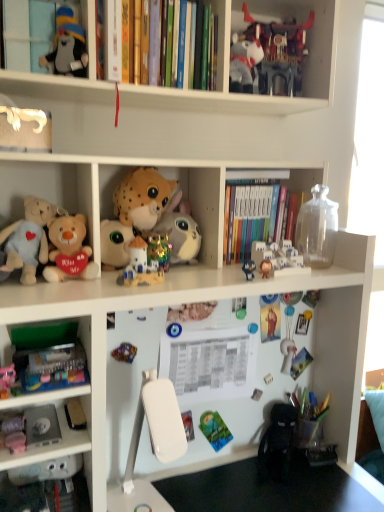
Identify the location of white plastic castle at upper center, marked as the fifth toy in a bottom-to-top arrangement. The image size is (384, 512). (279, 258).

This screenshot has width=384, height=512. Describe the element at coordinates (279, 258) in the screenshot. I see `white plastic castle at upper center, which ranks as the fifth toy in top-to-bottom order` at that location.

What is the approximate height of shiny plastic castle at center, arranged as the fourth toy when ordered from the bottom?

shiny plastic castle at center, arranged as the fourth toy when ordered from the bottom, is 4.32 inches tall.

Describe the element at coordinates (61, 228) in the screenshot. I see `soft plush toys at left, acting as the second shelf starting from the top` at that location.

Find the location of a particular element. This screenshot has height=512, width=384. matte black stuffed animal at upper left, the 2th shelf when ordered from bottom to top is located at coordinates (226, 90).

Measure the distance between soft plush toy at center, the 2th cabinet when ordered from top to bottom, and camera.

The depth of soft plush toy at center, the 2th cabinet when ordered from top to bottom, is 3.46 feet.

The image size is (384, 512). I want to click on soft plush toy at center, which is the 1th cabinet in right-to-left order, so pyautogui.click(x=173, y=212).

The image size is (384, 512). Describe the element at coordinates (207, 47) in the screenshot. I see `hardcover books at upper center, marked as the 2th book in a back-to-front arrangement` at that location.

Find the location of a particular element. The height and width of the screenshot is (512, 384). white plastic castle at upper center, marked as the fifth toy in a bottom-to-top arrangement is located at coordinates (279, 258).

Does matte pink plush at lower left, marked as the 9th toy in a top-to-bottom arrangement, have a smaller size compared to soft plush toys at left, acting as the second shelf starting from the top?

Indeed, matte pink plush at lower left, marked as the 9th toy in a top-to-bottom arrangement, has a smaller size compared to soft plush toys at left, acting as the second shelf starting from the top.

Based on the photo, is matte pink plush at lower left, arranged as the 1th toy when ordered from the bottom, at the left side of soft plush toys at left, acting as the second shelf starting from the top?

Yes.

From a real-world perspective, is matte pink plush at lower left, arranged as the 1th toy when ordered from the bottom, positioned over soft plush toys at left, acting as the second shelf starting from the top, based on gravity?

No.

Which is in front, point (23, 440) or point (60, 233)?

Positioned in front is point (23, 440).

Considering the sizes of objects hardcover books at center, marked as the second book in a front-to-back arrangement, and white plastic table at lower center in the image provided, who is shorter, hardcover books at center, marked as the second book in a front-to-back arrangement, or white plastic table at lower center?

With less height is white plastic table at lower center.

From a real-world perspective, between hardcover books at center, which is the 1th book from right to left, and white plastic table at lower center, who is vertically lower?

white plastic table at lower center, from a real-world perspective.

In the image, is hardcover books at center, marked as the second book in a front-to-back arrangement, positioned in front of or behind white plastic table at lower center?

Clearly, hardcover books at center, marked as the second book in a front-to-back arrangement, is behind white plastic table at lower center.

From the image's perspective, is hardcover books at center, the 2th book in the top-to-bottom sequence, above or below white plastic table at lower center?

Clearly, from the image's perspective, hardcover books at center, the 2th book in the top-to-bottom sequence, is above white plastic table at lower center.

From a real-world perspective, is hardcover books at center, placed as the 2th book when sorted from left to right, located beneath soft plush toys at left, the 1th shelf ordered from the bottom?

Actually, hardcover books at center, placed as the 2th book when sorted from left to right, is physically above soft plush toys at left, the 1th shelf ordered from the bottom, in the real world.

Does hardcover books at center, the 1th book ordered from the bottom, have a greater width compared to soft plush toys at left, acting as the second shelf starting from the top?

Yes.

In the scene shown: Between hardcover books at center, marked as the second book in a front-to-back arrangement, and soft plush toys at left, acting as the second shelf starting from the top, which one is positioned in front?

Positioned in front is soft plush toys at left, acting as the second shelf starting from the top.

Is fluffy beige bear at left, the sixth toy when ordered from bottom to top, turned away from shiny plastic robot at upper center, the ninth toy positioned from the bottom?

No, fluffy beige bear at left, the sixth toy when ordered from bottom to top, is not facing away from shiny plastic robot at upper center, the ninth toy positioned from the bottom.

At what (x,y) coordinates should I click in order to perform the action: click on the 6th toy counting from the left of the shiny plastic robot at upper center, which appears as the 1th toy when viewed from the top. Please return your answer as a coordinate pair (x, y). Looking at the image, I should click on (69, 250).

Between fluffy beige bear at left, the sixth toy when ordered from bottom to top, and shiny plastic robot at upper center, the ninth toy positioned from the bottom, which one is positioned behind?

shiny plastic robot at upper center, the ninth toy positioned from the bottom, is more distant.

Would you say fluffy beige bear at left, the sixth toy when ordered from bottom to top, is a long distance from shiny plastic robot at upper center, which appears as the 1th toy when viewed from the top?

They are positioned close to each other.

From a real-world perspective, between matte plush toy at upper left, the 2th cabinet from the right, and white plastic castle at upper center, marked as the fifth toy in a bottom-to-top arrangement, who is vertically lower?

white plastic castle at upper center, marked as the fifth toy in a bottom-to-top arrangement, is physically lower.

Is matte plush toy at upper left, positioned as the second cabinet in bottom-to-top order, next to white plastic castle at upper center, which ranks as the fifth toy in top-to-bottom order?

No, matte plush toy at upper left, positioned as the second cabinet in bottom-to-top order, is not in contact with white plastic castle at upper center, which ranks as the fifth toy in top-to-bottom order.

Is matte plush toy at upper left, the 1th cabinet viewed from the top, closer to camera compared to white plastic castle at upper center, which ranks as the fifth toy in top-to-bottom order?

Yes.

From the image's perspective, is matte plush toy at upper left, the 1th cabinet viewed from the top, beneath white plastic castle at upper center, marked as the fifth toy in a bottom-to-top arrangement?

Actually, matte plush toy at upper left, the 1th cabinet viewed from the top, appears above white plastic castle at upper center, marked as the fifth toy in a bottom-to-top arrangement, in the image.

What are the coordinates of `table lying in front of the hardcover books at upper center, the first book when ordered from left to right` in the screenshot? It's located at (267, 489).

Considering their positions, is hardcover books at upper center, the 1th book when ordered from front to back, located in front of or behind white plastic table at lower center?

hardcover books at upper center, the 1th book when ordered from front to back, is behind white plastic table at lower center.

Considering the sizes of hardcover books at upper center, the 1th book when ordered from front to back, and white plastic table at lower center in the image, is hardcover books at upper center, the 1th book when ordered from front to back, taller or shorter than white plastic table at lower center?

hardcover books at upper center, the 1th book when ordered from front to back, is taller than white plastic table at lower center.

Can you confirm if hardcover books at upper center, which ranks as the 2th book in right-to-left order, is wider than white plastic table at lower center?

Incorrect, the width of hardcover books at upper center, which ranks as the 2th book in right-to-left order, does not surpass that of white plastic table at lower center.

What's the angular difference between matte black stuffed animal at upper left, the 1th shelf when ordered from top to bottom, and matte blue plush at upper center, the 2th toy positioned from the bottom,'s facing directions?

matte black stuffed animal at upper left, the 1th shelf when ordered from top to bottom, and matte blue plush at upper center, the 2th toy positioned from the bottom, are facing 0.00356 degrees away from each other.

Does matte black stuffed animal at upper left, the 1th shelf when ordered from top to bottom, have a smaller size compared to matte blue plush at upper center, the eighth toy from the top?

Incorrect, matte black stuffed animal at upper left, the 1th shelf when ordered from top to bottom, is not smaller in size than matte blue plush at upper center, the eighth toy from the top.

How much distance is there between matte black stuffed animal at upper left, the 2th shelf when ordered from bottom to top, and matte blue plush at upper center, the 2th toy positioned from the bottom?

matte black stuffed animal at upper left, the 2th shelf when ordered from bottom to top, and matte blue plush at upper center, the 2th toy positioned from the bottom, are 52.67 centimeters apart.

Is matte black stuffed animal at upper left, the 1th shelf when ordered from top to bottom, in front of or behind matte blue plush at upper center, the eighth toy from the top, in the image?

matte black stuffed animal at upper left, the 1th shelf when ordered from top to bottom, is in front of matte blue plush at upper center, the eighth toy from the top.

From the image's perspective, count 7th toys downward from the soft plush toys at left, the 1th shelf ordered from the bottom, and point to it. Please provide its 2D coordinates.

[(13, 434)]

The width and height of the screenshot is (384, 512). I want to click on book that is the 1st object located above the white plastic table at lower center (from the image's perspective), so click(251, 216).

Considering their positions, is shiny plastic castle at center, the sixth toy when ordered from top to bottom, positioned further to fluffy beige stuffed animal at center-left, the seventh toy when ordered from bottom to top, than matte plush toy at upper left, positioned as the second cabinet in bottom-to-top order?

matte plush toy at upper left, positioned as the second cabinet in bottom-to-top order, is positioned further to the anchor fluffy beige stuffed animal at center-left, the seventh toy when ordered from bottom to top.

Considering their positions, is matte black plush toy at upper left, arranged as the eighth toy when ordered from the bottom, positioned closer to hardcover books at upper center, marked as the 2th book in a back-to-front arrangement, than matte blue plush at upper center, the 2th toy positioned from the bottom?

The object closer to hardcover books at upper center, marked as the 2th book in a back-to-front arrangement, is matte black plush toy at upper left, arranged as the eighth toy when ordered from the bottom.

Which object lies further to the anchor point shiny plastic robot at upper center, which appears as the 1th toy when viewed from the top, fluffy beige bear at left, which ranks as the 4th toy in top-to-bottom order, or hardcover books at center, which is the 1th book from right to left?

The object further to shiny plastic robot at upper center, which appears as the 1th toy when viewed from the top, is fluffy beige bear at left, which ranks as the 4th toy in top-to-bottom order.

When comparing their distances from matte pink plush at lower left, marked as the 9th toy in a top-to-bottom arrangement, does matte black stuffed animal at upper left, the 1th shelf when ordered from top to bottom, or shiny plastic castle at center, the sixth toy when ordered from top to bottom, seem closer?

shiny plastic castle at center, the sixth toy when ordered from top to bottom, is closer to matte pink plush at lower left, marked as the 9th toy in a top-to-bottom arrangement.

Based on their spatial positions, is soft plush toys at left, acting as the second shelf starting from the top, or shiny plastic castle at center, the sixth toy when ordered from top to bottom, further from soft plush toy at center, which is counted as the 1th cabinet, starting from the bottom?

Based on the image, soft plush toys at left, acting as the second shelf starting from the top, appears to be further to soft plush toy at center, which is counted as the 1th cabinet, starting from the bottom.

Considering their positions, is matte black plush toy at upper left, acting as the second toy starting from the top, positioned closer to metallic multicolored toy at center, the 7th toy when ordered from top to bottom, than matte black stuffed animal at upper left, the 2th shelf when ordered from bottom to top?

Based on the image, matte black stuffed animal at upper left, the 2th shelf when ordered from bottom to top, appears to be nearer to metallic multicolored toy at center, the 7th toy when ordered from top to bottom.

Based on their spatial positions, is matte blue plush at upper center, the eighth toy from the top, or matte black stuffed animal at upper left, the 2th shelf when ordered from bottom to top, closer to white plastic table at lower center?

Based on the image, matte blue plush at upper center, the eighth toy from the top, appears to be nearer to white plastic table at lower center.

Which object lies further to the anchor point white plastic table at lower center, matte plush toy at upper left, positioned as the second cabinet in bottom-to-top order, or soft plush toys at left, acting as the second shelf starting from the top?

The object further to white plastic table at lower center is matte plush toy at upper left, positioned as the second cabinet in bottom-to-top order.

In order to click on toy located between metallic multicolored toy at center, the 7th toy when ordered from top to bottom, and hardcover books at center, the 1th book ordered from the bottom, in the left-right direction in this screenshot , I will do `click(249, 269)`.

Find the location of a particular element. The width and height of the screenshot is (384, 512). shelf between matte plush toy at upper left, the 2th cabinet from the right, and shiny plastic robot at upper center, the ninth toy positioned from the bottom, from left to right is located at coordinates (226, 90).

At what (x,y) coordinates should I click in order to perform the action: click on shelf between hardcover books at upper center, the 1th book positioned from the top, and matte blue plush at upper center, the eighth toy from the top, in the vertical direction. Please return your answer as a coordinate pair (x, y). The image size is (384, 512). Looking at the image, I should click on (61, 228).

This screenshot has height=512, width=384. I want to click on toy between hardcover books at upper center, which ranks as the 2th book in right-to-left order, and soft plush toy at center, which is counted as the 1th cabinet, starting from the bottom, in the vertical direction, so click(67, 46).